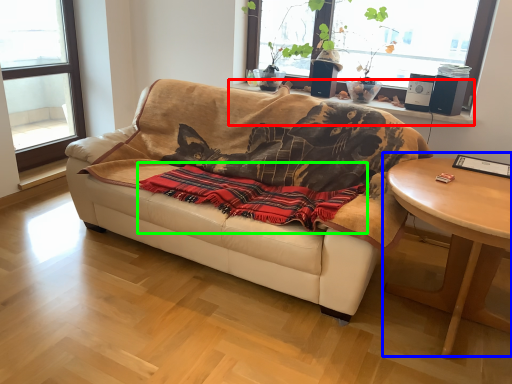
Question: Which is nearer to the window sill (highlighted by a red box)? coffee table (highlighted by a blue box) or blanket (highlighted by a green box).

Choices:
 (A) coffee table
 (B) blanket

Answer: (A)